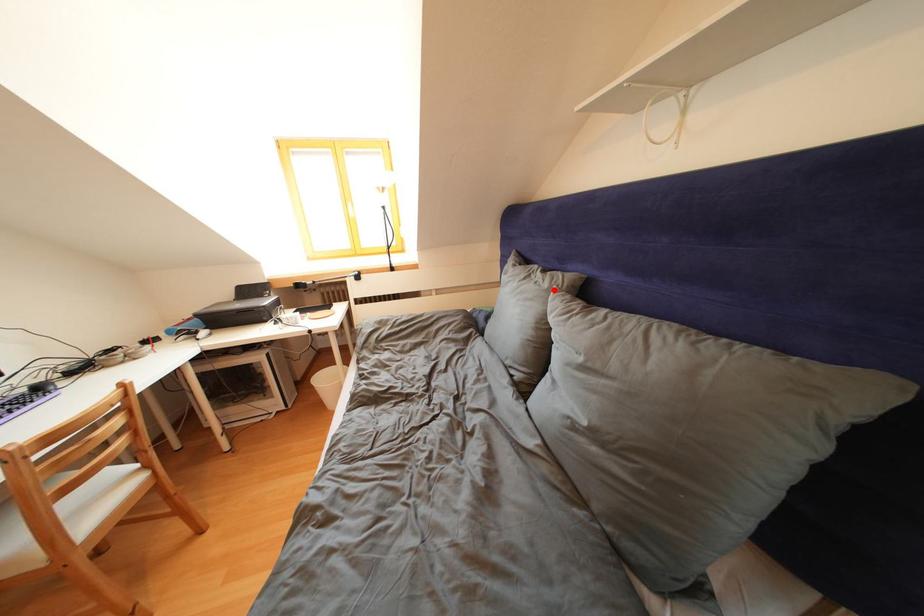
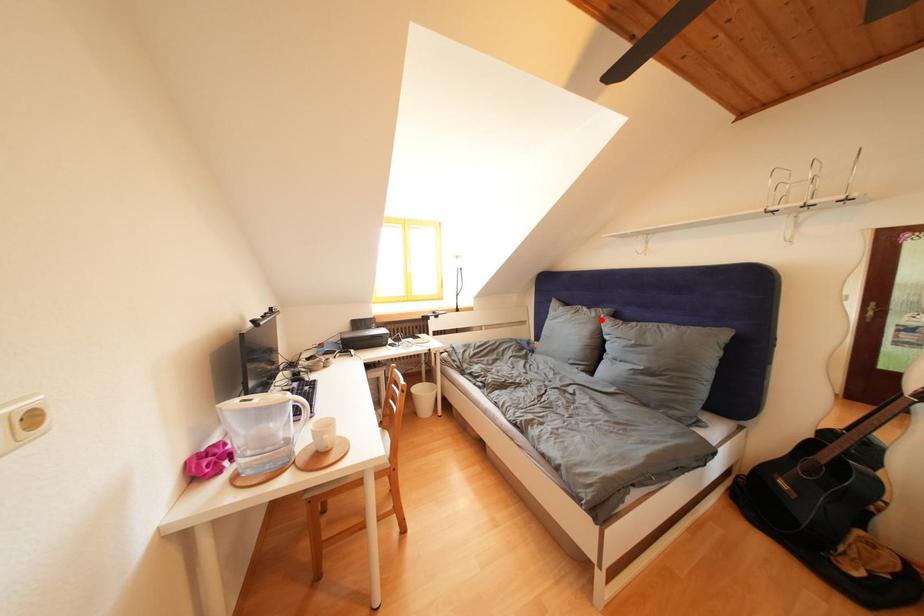
I am providing you with two images of the same scene from different viewpoints. A red point is marked on the first image and another point is marked on the second image. Is the red point in image1 aligned with the point shown in image2?

Yes